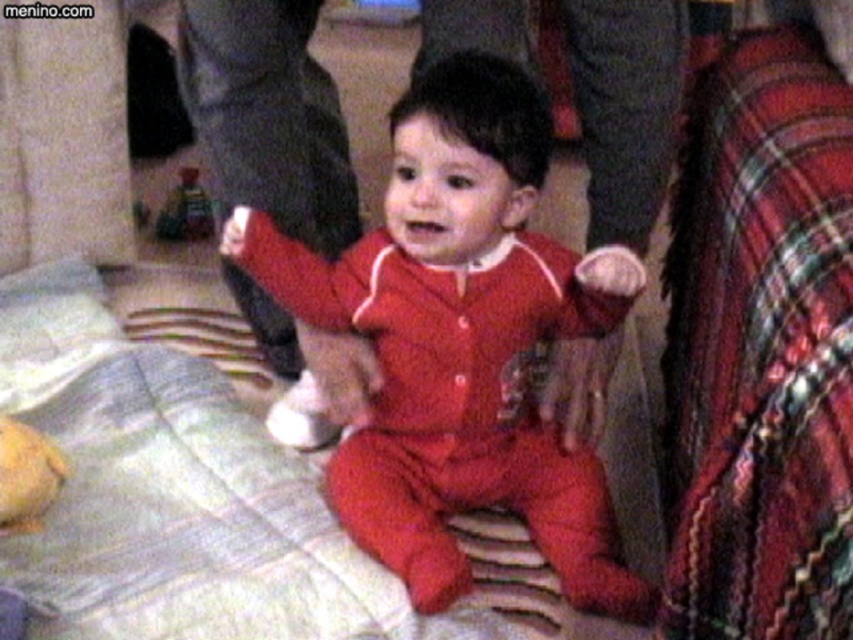
Question: Which point is farther from the camera taking this photo?

Choices:
 (A) (190, 192)
 (B) (393, 566)

Answer: (A)

Question: Is matte red pajamas at center bigger than plastic toy at center?

Choices:
 (A) yes
 (B) no

Answer: (A)

Question: Which point is closer to the camera?

Choices:
 (A) plastic toy at center
 (B) matte red pajamas at center

Answer: (B)

Question: Which point appears closest to the camera in this image?

Choices:
 (A) click(x=442, y=124)
 (B) click(x=172, y=193)

Answer: (A)

Question: Can you confirm if matte red pajamas at center is smaller than plastic toy at center?

Choices:
 (A) yes
 (B) no

Answer: (B)

Question: Is matte red pajamas at center thinner than plastic toy at center?

Choices:
 (A) no
 (B) yes

Answer: (A)